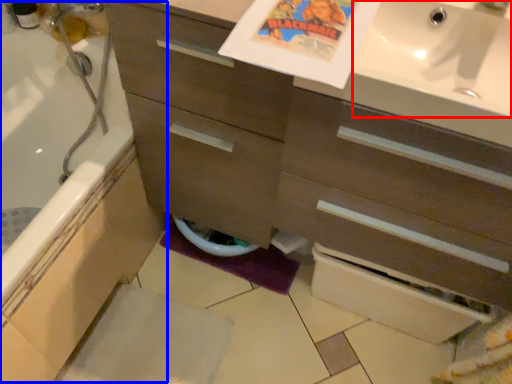
Question: Among these objects, which one is nearest to the camera, sink (highlighted by a red box) or bath (highlighted by a blue box)?

Choices:
 (A) sink
 (B) bath

Answer: (A)